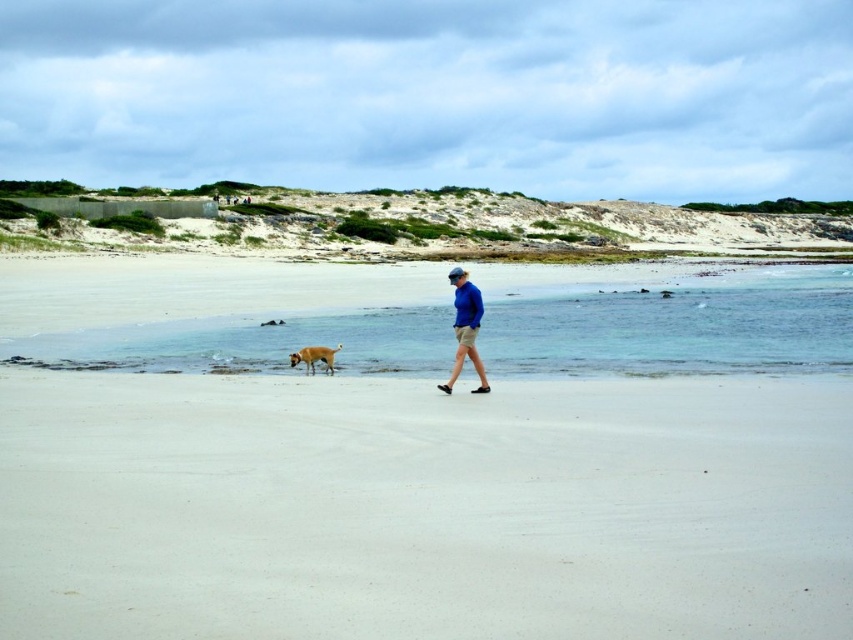
Does blue cotton shirt at center appear on the right side of golden fur dog at center?

Indeed, blue cotton shirt at center is positioned on the right side of golden fur dog at center.

Is blue cotton shirt at center thinner than golden fur dog at center?

Indeed, blue cotton shirt at center has a lesser width compared to golden fur dog at center.

Is point (467, 326) farther from viewer compared to point (302, 358)?

No, it is not.

In order to click on blue cotton shirt at center in this screenshot , I will do `click(465, 326)`.

Between white sand at center and blue cotton shirt at center, which one has more height?

Standing taller between the two is blue cotton shirt at center.

Is white sand at center to the left of blue cotton shirt at center from the viewer's perspective?

Indeed, white sand at center is positioned on the left side of blue cotton shirt at center.

The image size is (853, 640). What do you see at coordinates (422, 508) in the screenshot?
I see `white sand at center` at bounding box center [422, 508].

Where is `white sand at center`? The image size is (853, 640). white sand at center is located at coordinates (422, 508).

Between white sand at center and golden fur dog at center, which one has more height?

With more height is white sand at center.

Between white sand at center and golden fur dog at center, which one is positioned higher?

Positioned higher is golden fur dog at center.

In order to click on white sand at center in this screenshot , I will do [x=422, y=508].